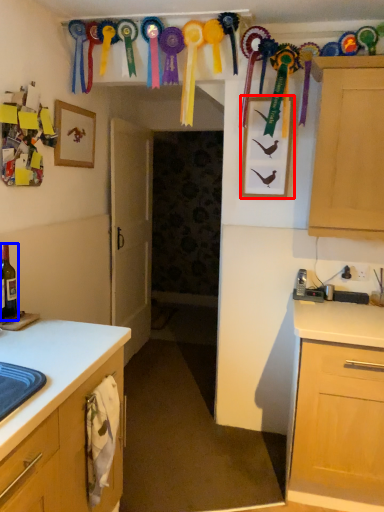
Question: Which point is further to the camera, picture frame (highlighted by a red box) or beer bottle (highlighted by a blue box)?

Choices:
 (A) picture frame
 (B) beer bottle

Answer: (A)